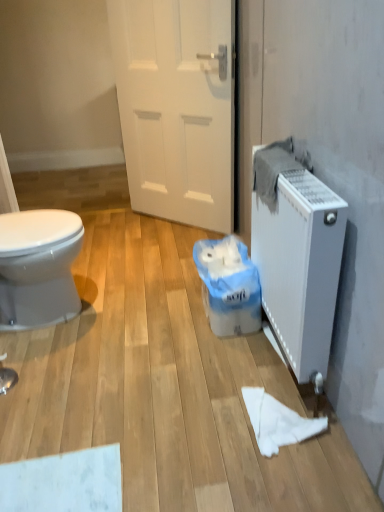
Identify the location of vacant space underneath white paper towel at lower center (from a real-world perspective). This screenshot has height=512, width=384. [x=281, y=422].